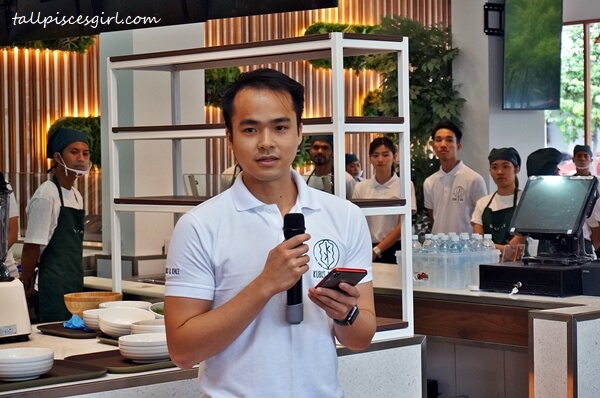
At what (x,y) coordinates should I click in order to perform the action: click on shelves. Please return your answer as a coordinate pair (x, y). Image resolution: width=600 pixels, height=398 pixels. Looking at the image, I should click on (187, 132), (161, 200), (391, 321).